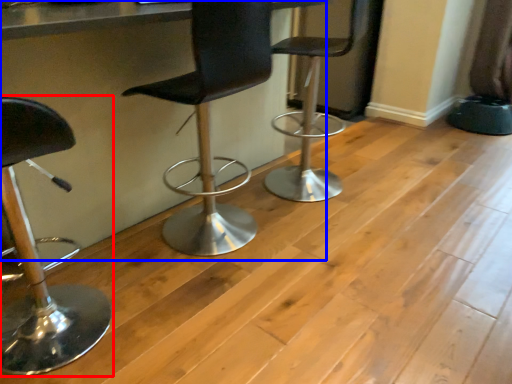
Question: Which of the following is the farthest to the observer, chair (highlighted by a red box) or table (highlighted by a blue box)?

Choices:
 (A) chair
 (B) table

Answer: (B)